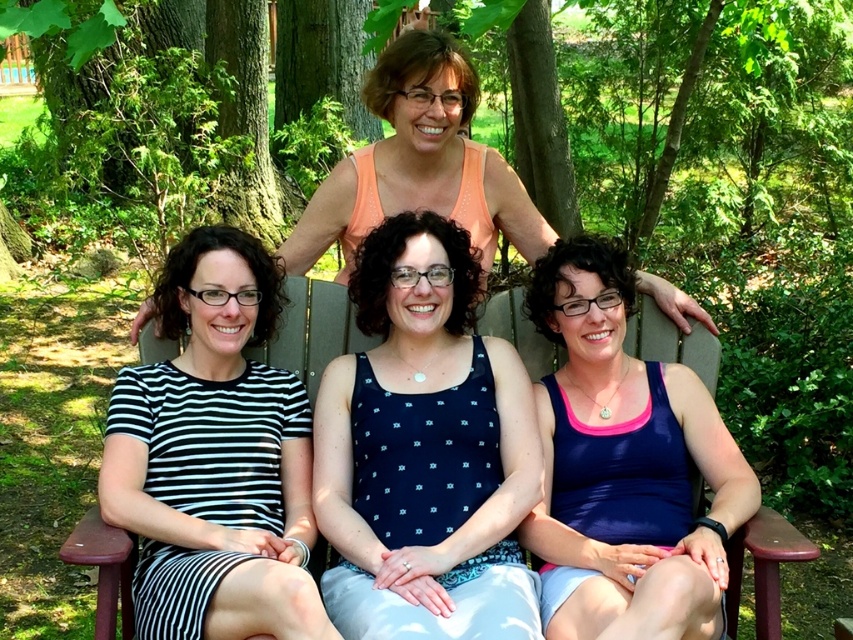
Can you confirm if black striped dress at left is taller than wooden park bench at center?

Correct, black striped dress at left is much taller as wooden park bench at center.

Can you confirm if black striped dress at left is smaller than wooden park bench at center?

No.

Locate an element on the screen. black striped dress at left is located at coordinates (215, 456).

Between black striped dress at left and blue fabric tank top at lower right, which one is positioned higher?

blue fabric tank top at lower right is above.

From the picture: Can you confirm if black striped dress at left is bigger than blue fabric tank top at lower right?

Correct, black striped dress at left is larger in size than blue fabric tank top at lower right.

What do you see at coordinates (215, 456) in the screenshot? I see `black striped dress at left` at bounding box center [215, 456].

Find the location of a particular element. black striped dress at left is located at coordinates point(215,456).

Does blue dotted tank top at center have a greater height compared to wooden park bench at center?

Answer: Yes.

Which of these two, blue dotted tank top at center or wooden park bench at center, stands taller?

→ Standing taller between the two is blue dotted tank top at center.

Is point (357, 614) positioned after point (776, 586)?

No, it is in front of (776, 586).

This screenshot has width=853, height=640. I want to click on blue dotted tank top at center, so click(x=424, y=451).